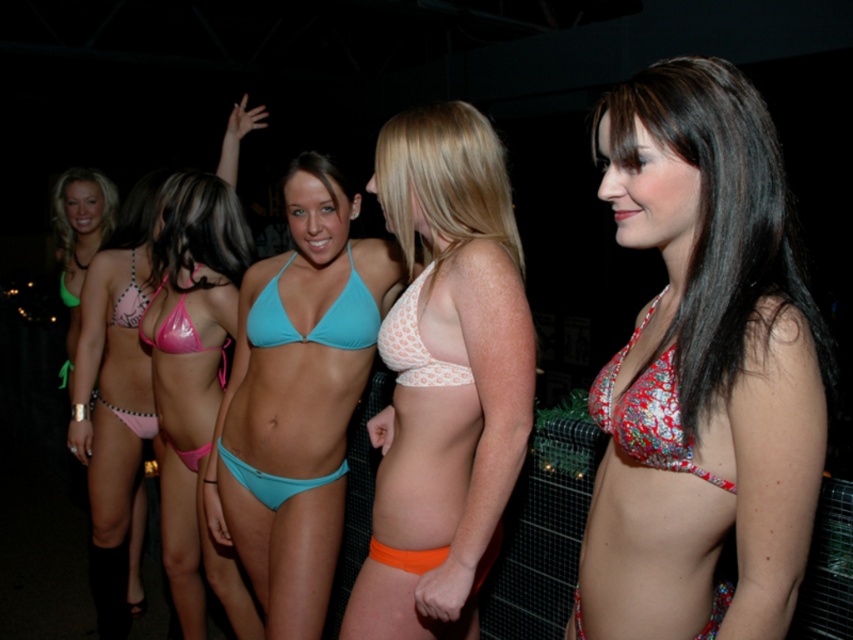
You are a photographer at the event and want to capture a shot of the white dotted fabric bikini bottom at center and the white mesh bikini top at center. Since the lighting is dim, you need to ensure both are visible. Which one should you focus on first to make sure they are both in frame?

The white dotted fabric bikini bottom at center is to the left of the white mesh bikini top at center, so focusing on the white mesh bikini top at center first would ensure both are in frame as you adjust the camera settings for the dim lighting.

Based on the photo, you are a photographer trying to capture a closeup shot of the white dotted fabric bikini bottom at center and the white mesh bikini top at center. Since the camera can only focus on one object at a time, which one should you choose to ensure it appears larger in the photo?

The white mesh bikini top at center is larger than the white dotted fabric bikini bottom at center, so you should focus on the white mesh bikini top at center to capture a larger image.